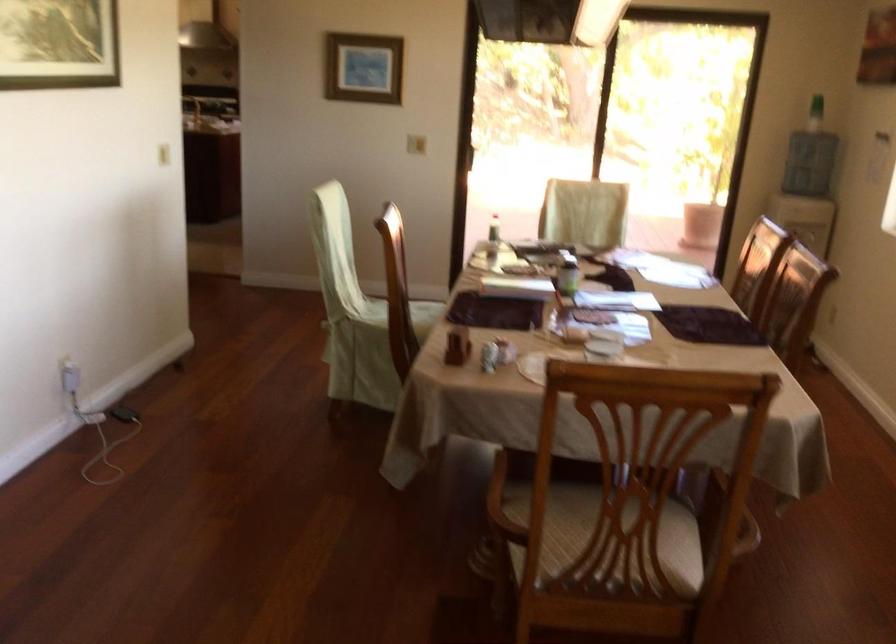
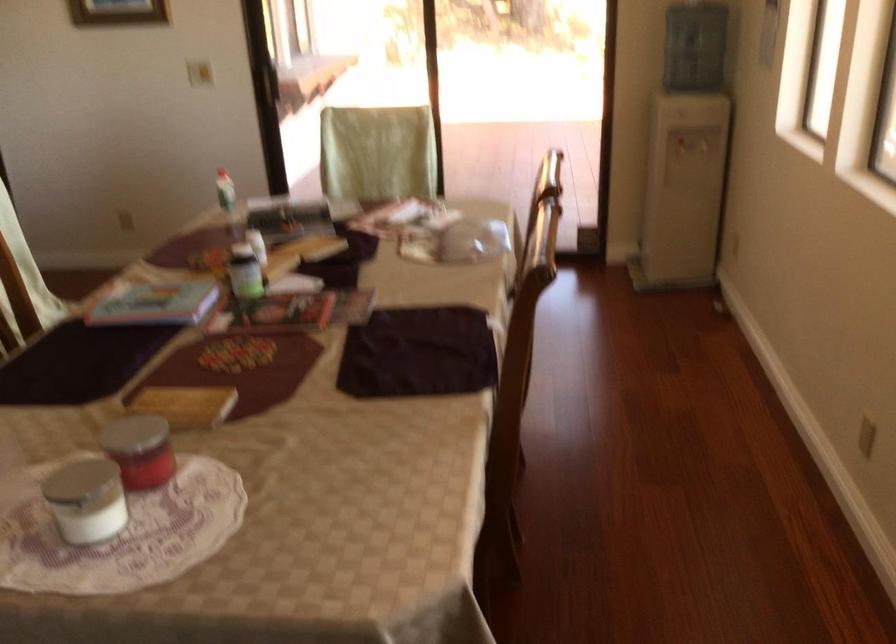
What movement of the cameraman would produce the second image?

The cameraman walked toward right, forward.